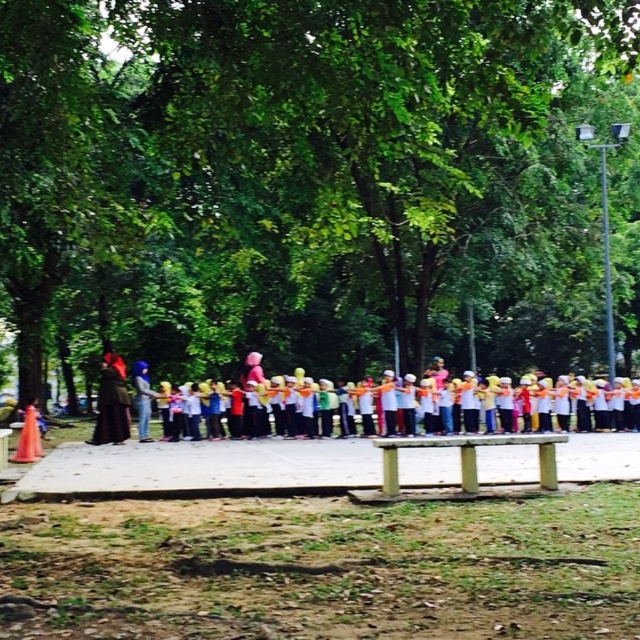
You are a photographer taking a picture of the group in the park. You want to ensure both the white cotton scarf at center and the matte purple hijab at center are visible in the frame. Which item should you position closer to the right side of the camera to achieve this?

The white cotton scarf at center is to the right of the matte purple hijab at center, so positioning the white cotton scarf at center closer to the right side of the camera will ensure both items are visible in the frame.

You are a photographer trying to capture both the white cotton scarf at center and the matte purple hijab at center in a single frame. Which object should you focus on to ensure both are visible without zooming in or out?

The white cotton scarf at center occupies less space than the matte purple hijab at center, so focusing on the matte purple hijab at center would allow both objects to fit within the frame without needing to adjust the zoom.

You are a photographer standing in the park and notice two head coverings in the scene. The white cotton scarf at center and the matte purple hijab at center. Which one appears closer to you?

The white cotton scarf at center is closer to you since it is further to the viewer than the matte purple hijab at center.